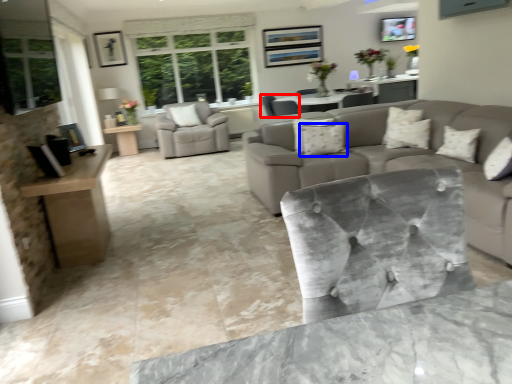
Question: Which object appears closest to the camera in this image, chair (highlighted by a red box) or pillow (highlighted by a blue box)?

Choices:
 (A) chair
 (B) pillow

Answer: (B)